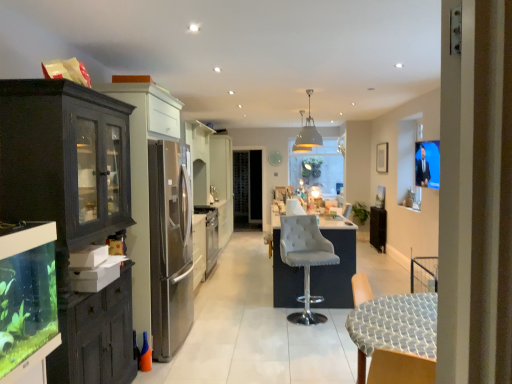
Question: From a real-world perspective, is metallic gray pendant light at upper center, positioned as the first lamp in back-to-front order, physically located above or below satin silver oven at center?

Choices:
 (A) below
 (B) above

Answer: (B)

Question: Is metallic gray pendant light at upper center, the second lamp positioned from the front, taller or shorter than satin silver oven at center?

Choices:
 (A) tall
 (B) short

Answer: (B)

Question: Which object is the closest to the suede-like white bar stool at center, marked as the first chair in a back-to-front arrangement?

Choices:
 (A) metallic gray pendant light at upper center, positioned as the first lamp in back-to-front order
 (B) wooden chair at lower right, which appears as the 1th chair when viewed from the front
 (C) clear glass aquarium at left
 (D) matte white pendant light at upper center, arranged as the first lamp when viewed from the front
 (E) satin silver oven at center

Answer: (B)

Question: Estimate the real-world distances between objects in this image. Which object is closer to the matte white pendant light at upper center, which is the second lamp from back to front?

Choices:
 (A) wooden chair at lower right, which appears as the 1th chair when viewed from the front
 (B) satin silver oven at center
 (C) metallic gray pendant light at upper center, the second lamp positioned from the front
 (D) clear glass aquarium at left
 (E) suede-like white bar stool at center, acting as the second chair starting from the front

Answer: (C)